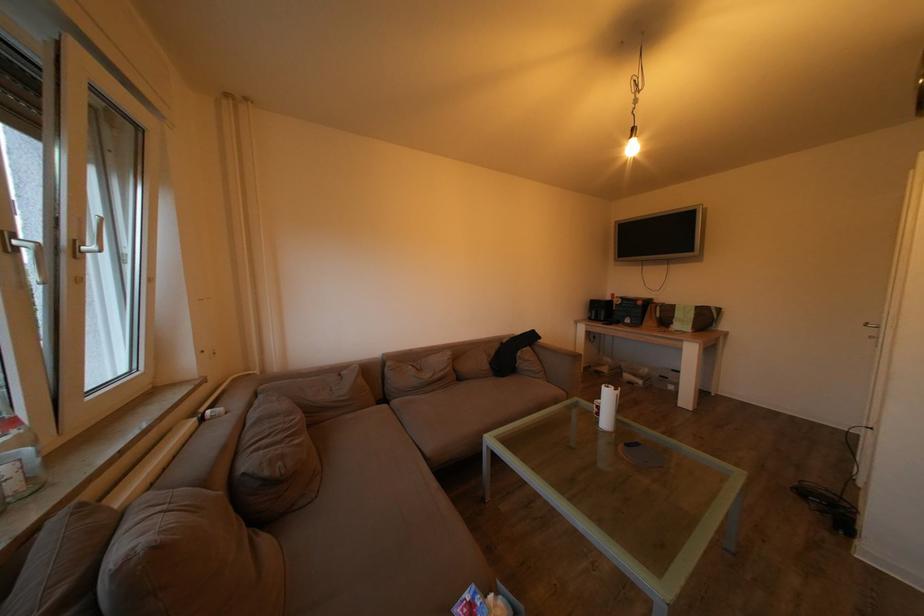
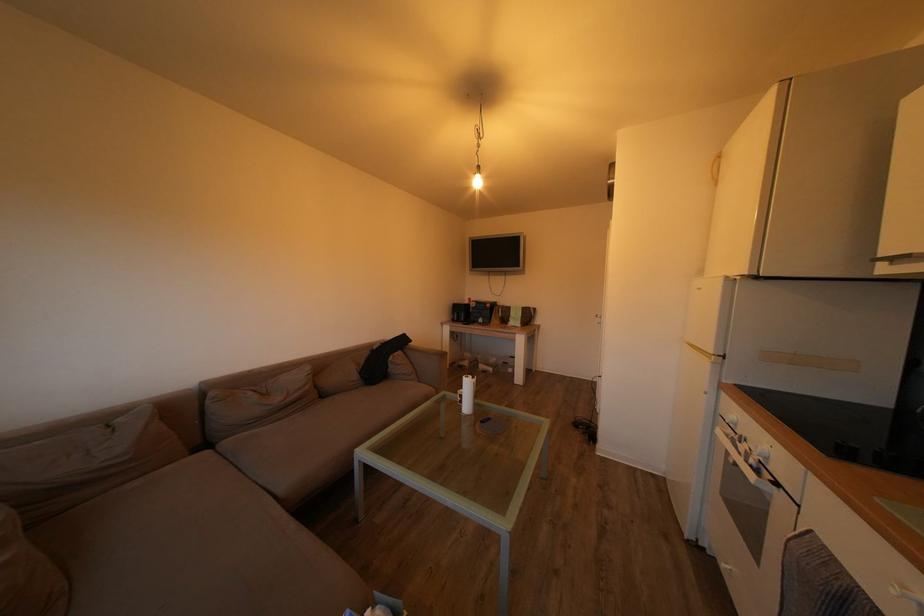
Question: The camera is either moving clockwise (left) or counter-clockwise (right) around the object. The first image is from the beginning of the video and the second image is from the end. Is the camera moving left or right when shooting the video?

Choices:
 (A) Left
 (B) Right

Answer: (A)